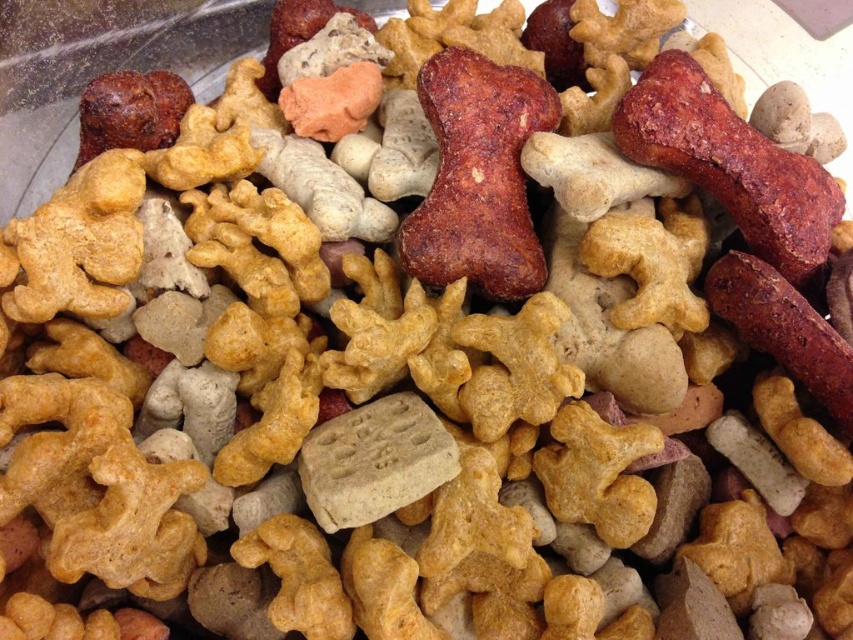
You are a dog owner trying to find a treat for your pet. You see the brown crumbly bone at center and the red matte bone at center. Which treat is closer to you?

The brown crumbly bone at center is closer to you because it is in front of the red matte bone at center.

You are a dog owner trying to give your dog a treat. You see the brown crumbly bone at center and the red matte bone at center. If you want to give your dog the treat closest to the other bone, which one should you choose?

Both the brown crumbly bone at center and the red matte bone at center are at the same central position, so they are equally close to each other.